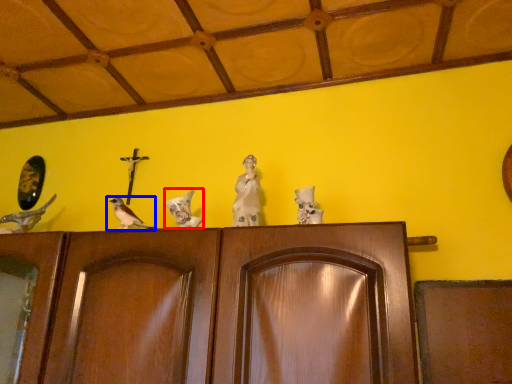
Question: Which of the following is the closest to the observer, bird (highlighted by a red box) or bird (highlighted by a blue box)?

Choices:
 (A) bird
 (B) bird

Answer: (A)